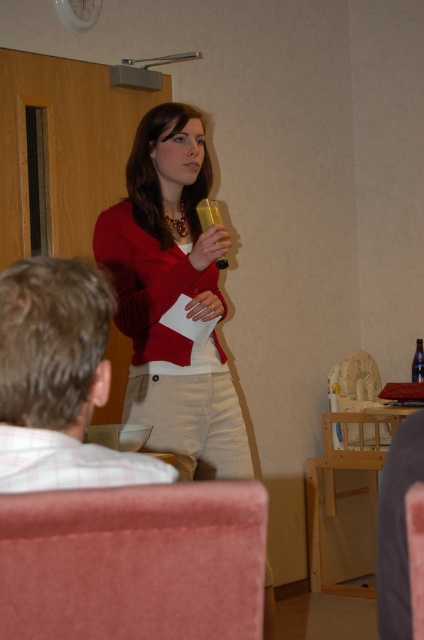
Measure the distance between translucent plastic cup at center and camera.

translucent plastic cup at center and camera are 2.42 meters apart.

Looking at this image, does translucent plastic cup at center have a lesser height compared to translucent plastic bottle at center?

No.

Where is `translucent plastic cup at center`? translucent plastic cup at center is located at coordinates (208, 212).

Can you confirm if matte red sweater at center is positioned to the right of translucent plastic bottle at center?

In fact, matte red sweater at center is to the left of translucent plastic bottle at center.

Who is lower down, matte red sweater at center or translucent plastic bottle at center?

Positioned lower is translucent plastic bottle at center.

I want to click on matte red sweater at center, so click(172, 296).

Locate an element on the screen. Image resolution: width=424 pixels, height=640 pixels. matte red sweater at center is located at coordinates (172, 296).

Can you confirm if matte red sweater at center is wider than plaid shirt at left?

Correct, the width of matte red sweater at center exceeds that of plaid shirt at left.

Can you confirm if matte red sweater at center is taller than plaid shirt at left?

Correct, matte red sweater at center is much taller as plaid shirt at left.

Is point (234, 449) positioned after point (72, 484)?

That is True.

I want to click on matte red sweater at center, so click(172, 296).